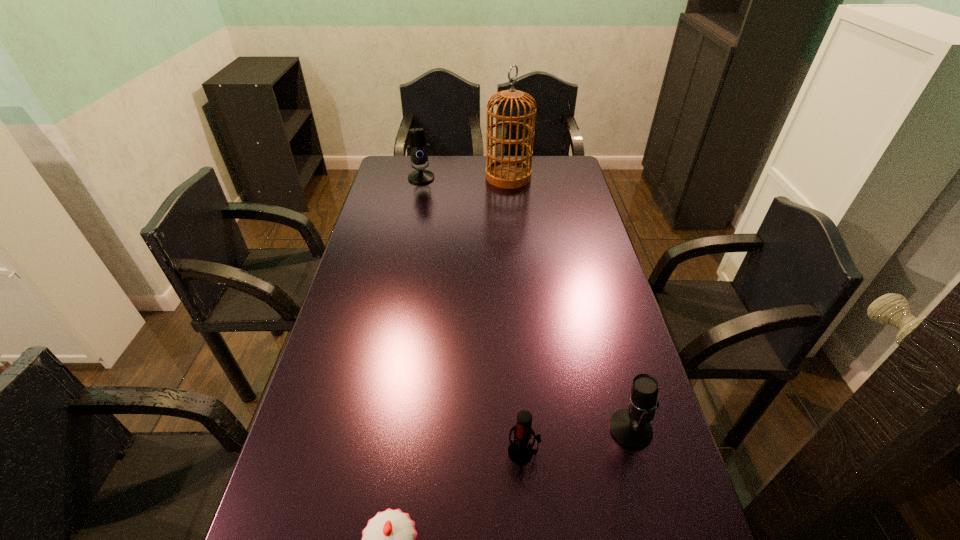
This screenshot has height=540, width=960. Identify the location of blank region between the second tallest microphone and the shortest microphone. (577, 441).

Where is `free area in between the fourth tallest object and the birdcage`? The image size is (960, 540). free area in between the fourth tallest object and the birdcage is located at coordinates (516, 314).

This screenshot has width=960, height=540. Find the location of `vacant region between the farthest microphone and the birdcage`. vacant region between the farthest microphone and the birdcage is located at coordinates (465, 177).

In order to click on unoccupied area between the birdcage and the shortest microphone in this screenshot , I will do `click(516, 314)`.

At what (x,y) coordinates should I click in order to perform the action: click on free spot between the farthest microphone and the tallest object. Please return your answer as a coordinate pair (x, y). Looking at the image, I should click on (465, 177).

Locate an element on the screen. vacant region between the farthest microphone and the second shortest microphone is located at coordinates (526, 303).

Identify the location of object that is the second closest to the birdcage. coord(631,427).

I want to click on object that stands as the second closest to the birdcage, so click(x=631, y=427).

Locate an element on the screen. microphone that stands as the second closest to the shortest object is located at coordinates (631, 427).

Select which microphone appears as the closest to the third shortest object. Please provide its 2D coordinates. Your answer should be formatted as a tuple, i.e. [(x, y)], where the tuple contains the x and y coordinates of a point satisfying the conditions above.

[(520, 451)]